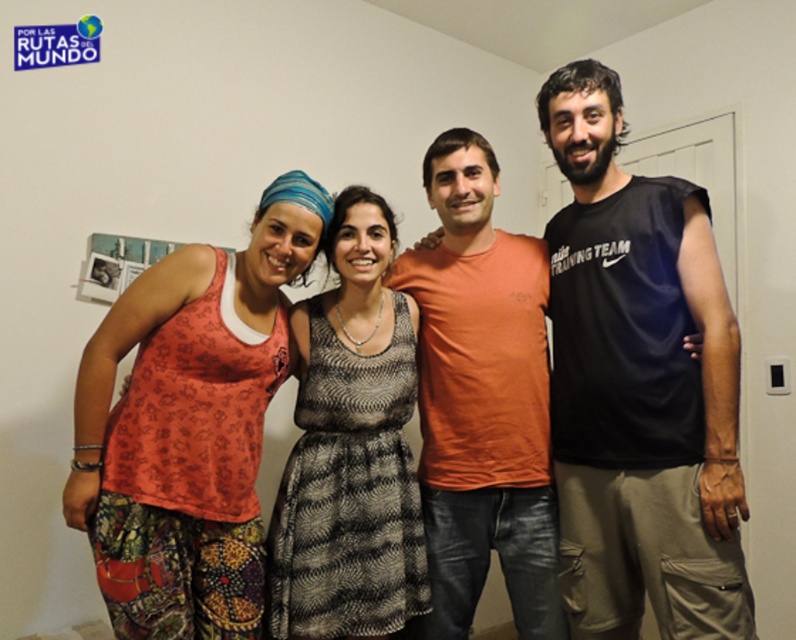
Question: Which point is closer to the camera?

Choices:
 (A) printed cotton tank top at left
 (B) matte black tank top at center
 (C) patterned fabric dress at center
 (D) black sleeveless shirt at right

Answer: (D)

Question: Is black sleeveless shirt at right further to camera compared to printed cotton tank top at left?

Choices:
 (A) yes
 (B) no

Answer: (B)

Question: Is printed cotton tank top at left in front of matte black tank top at center?

Choices:
 (A) no
 (B) yes

Answer: (B)

Question: Which point is farther from the camera taking this photo?

Choices:
 (A) (119, 438)
 (B) (623, 467)
 (C) (506, 472)
 (D) (326, 371)

Answer: (C)

Question: Which object is the farthest from the black sleeveless shirt at right?

Choices:
 (A) matte black tank top at center
 (B) printed cotton tank top at left

Answer: (B)

Question: Can you confirm if matte black tank top at center is positioned to the left of patterned fabric dress at center?

Choices:
 (A) no
 (B) yes

Answer: (A)